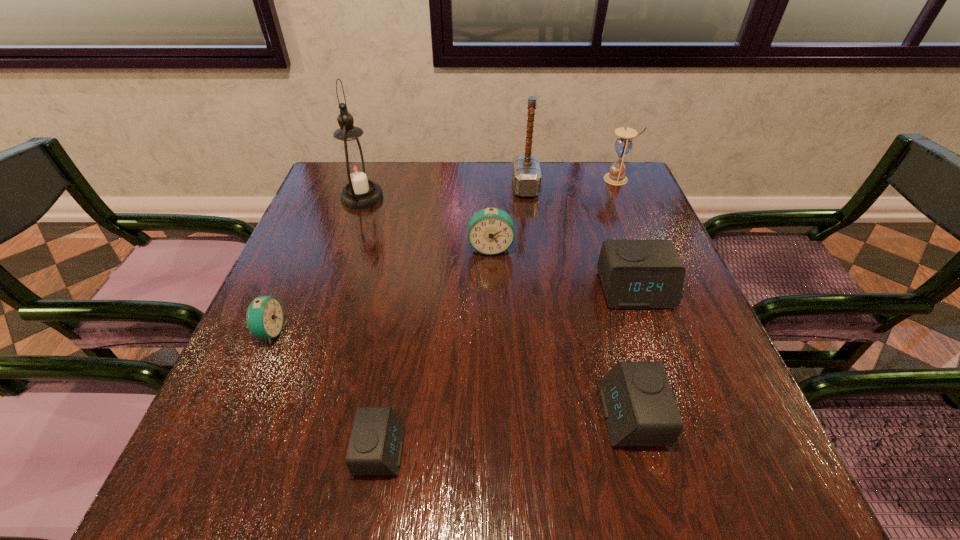
The image size is (960, 540). In order to click on free space located 0.350m on the front-facing side of the fourth tallest object in this screenshot , I will do `click(494, 385)`.

At what (x,y) coordinates should I click in order to perform the action: click on blank space located on the front-facing side of the fifth farthest object. Please return your answer as a coordinate pair (x, y). This screenshot has width=960, height=540. Looking at the image, I should click on (663, 371).

Where is `free space located 0.380m on the front-facing side of the smaller blue alarm clock`? The image size is (960, 540). free space located 0.380m on the front-facing side of the smaller blue alarm clock is located at coordinates (471, 332).

At what (x,y) coordinates should I click in order to perform the action: click on free spot located on the front-facing side of the second smallest black alarm clock. Please return your answer as a coordinate pair (x, y). Looking at the image, I should click on (387, 415).

Where is `vacant space positioned on the front-facing side of the second smallest black alarm clock`? The height and width of the screenshot is (540, 960). vacant space positioned on the front-facing side of the second smallest black alarm clock is located at coordinates (516, 415).

Identify the location of free spot located 0.380m on the front-facing side of the second smallest black alarm clock. This screenshot has height=540, width=960. (381, 415).

Where is `vacant area located 0.170m on the front-facing side of the sixth object from right to left`? The image size is (960, 540). vacant area located 0.170m on the front-facing side of the sixth object from right to left is located at coordinates (508, 449).

I want to click on oil lamp that is at the far edge, so click(x=355, y=168).

Where is `hammer that is at the far edge`? This screenshot has height=540, width=960. hammer that is at the far edge is located at coordinates pyautogui.click(x=526, y=174).

Locate an element on the screen. This screenshot has height=540, width=960. hourglass located in the far edge section of the desktop is located at coordinates 623,144.